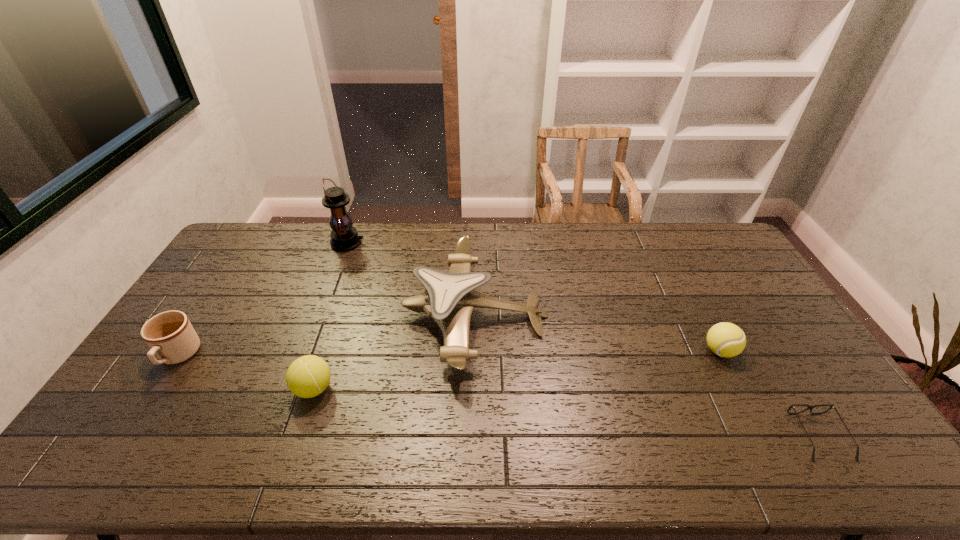
The image size is (960, 540). I want to click on vacant region between the tallest object and the leftmost object, so click(x=263, y=300).

The width and height of the screenshot is (960, 540). I want to click on free space between the fourth object from left to right and the leftmost object, so click(x=326, y=336).

Find the location of a particular element. The height and width of the screenshot is (540, 960). free area in between the rightmost object and the third object from right to left is located at coordinates (647, 376).

Find the location of a particular element. This screenshot has width=960, height=540. vacant region between the second object from right to left and the third object from right to left is located at coordinates (598, 333).

I want to click on object that stands as the closest to the leftmost object, so click(308, 376).

Identify the location of the fifth closest object to the leftmost object. The height and width of the screenshot is (540, 960). (831, 405).

What are the coordinates of `blank area in the image that satisfies the following two spatial constraints: 1. above the farthest object, indicating its light source; 2. on the back side of the fifth object from left to right` in the screenshot? It's located at (306, 351).

You are a GUI agent. You are given a task and a screenshot of the screen. Output one action in this format:
    pyautogui.click(x=<x>, y=<y>)
    Task: Click on the vacant space that satisfies the following two spatial constraints: 1. above the second object from right to left, indicating its light source; 2. on the left side of the lantern
    
    Given the screenshot: What is the action you would take?
    pyautogui.click(x=306, y=351)